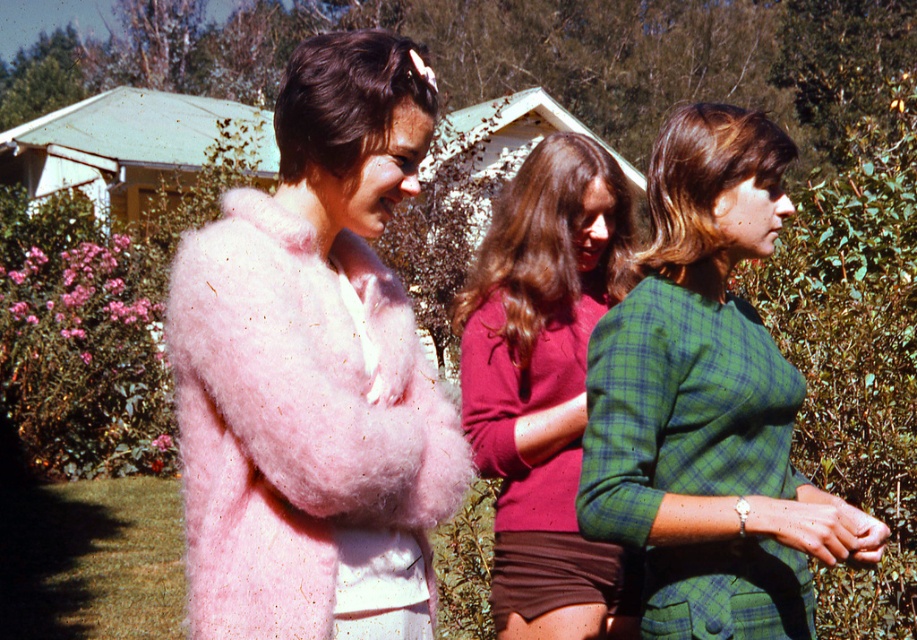
Question: Estimate the real-world distances between objects in this image. Which object is closer to the pink fluffy coat at left?

Choices:
 (A) plaid fabric shirt at center
 (B) green plaid dress at right

Answer: (B)

Question: Which object is farther from the camera taking this photo?

Choices:
 (A) plaid fabric shirt at center
 (B) green plaid dress at right

Answer: (A)

Question: Does green plaid dress at right appear on the left side of plaid fabric shirt at center?

Choices:
 (A) no
 (B) yes

Answer: (A)

Question: Is pink fluffy coat at left thinner than plaid fabric shirt at center?

Choices:
 (A) yes
 (B) no

Answer: (B)

Question: Which of the following is the farthest from the observer?

Choices:
 (A) (678, 573)
 (B) (538, 288)
 (C) (194, 636)

Answer: (B)

Question: In this image, where is pink fluffy coat at left located relative to plaid fabric shirt at center?

Choices:
 (A) right
 (B) left

Answer: (B)